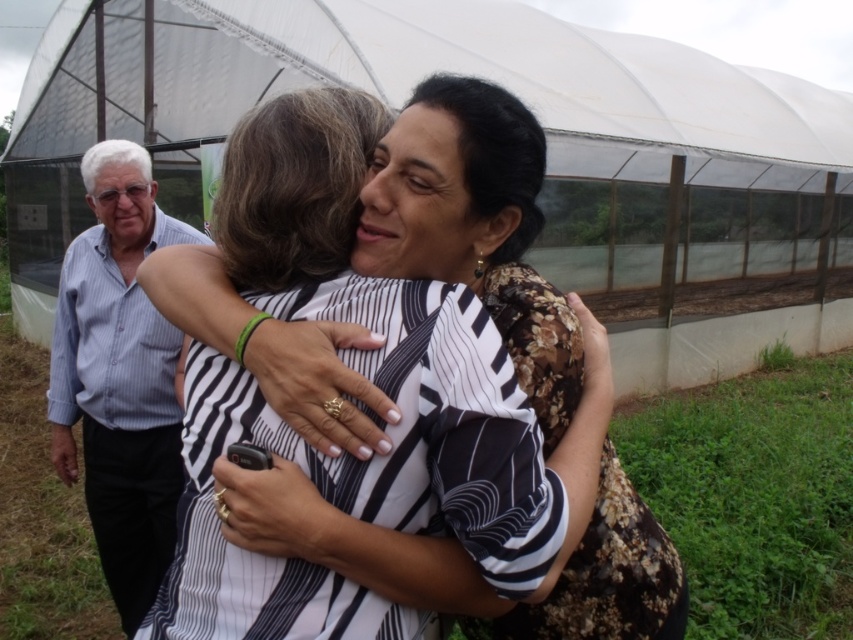
Question: Can you confirm if striped fabric shirt at center is positioned below black floral dress at center?

Choices:
 (A) yes
 (B) no

Answer: (B)

Question: Is striped fabric shirt at center smaller than black floral dress at center?

Choices:
 (A) yes
 (B) no

Answer: (B)

Question: Estimate the real-world distances between objects in this image. Which object is farther from the striped fabric shirt at center?

Choices:
 (A) blue striped shirt at left
 (B) black floral dress at center

Answer: (A)

Question: Which point is closer to the camera taking this photo?

Choices:
 (A) (442, 369)
 (B) (473, 145)
 (C) (105, 403)

Answer: (A)

Question: Is striped fabric shirt at center further to camera compared to black floral dress at center?

Choices:
 (A) yes
 (B) no

Answer: (B)

Question: Which of these objects is positioned closest to the blue striped shirt at left?

Choices:
 (A) striped fabric shirt at center
 (B) black floral dress at center

Answer: (A)